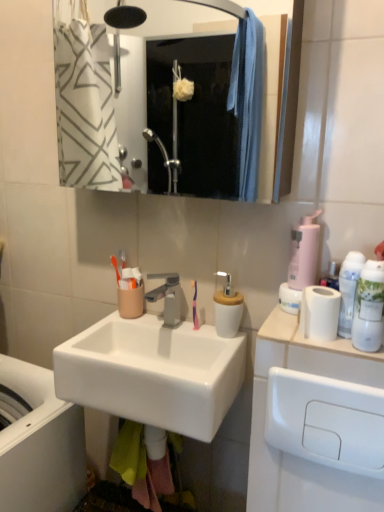
Question: Does white glossy mouthwash at right, which is the second mouthwash in back-to-front order, turn towards metallic silver mirror at upper center?

Choices:
 (A) no
 (B) yes

Answer: (A)

Question: Is white glossy mouthwash at right, which is the second mouthwash in back-to-front order, wider than metallic silver mirror at upper center?

Choices:
 (A) yes
 (B) no

Answer: (B)

Question: Is white glossy mouthwash at right, marked as the 1th mouthwash in a front-to-back arrangement, positioned far away from metallic silver mirror at upper center?

Choices:
 (A) yes
 (B) no

Answer: (A)

Question: Is white glossy mouthwash at right, marked as the 1th mouthwash in a front-to-back arrangement, positioned behind metallic silver mirror at upper center?

Choices:
 (A) yes
 (B) no

Answer: (B)

Question: Is metallic silver mirror at upper center completely or partially inside white glossy mouthwash at right, which is the second mouthwash in back-to-front order?

Choices:
 (A) no
 (B) yes

Answer: (A)

Question: From the image's perspective, relative to white plastic mouthwash at right, which is counted as the 1th mouthwash, starting from the back, is satin nickel faucet at center above or below?

Choices:
 (A) above
 (B) below

Answer: (B)

Question: Considering the positions of point (168, 311) and point (339, 308), is point (168, 311) closer or farther from the camera than point (339, 308)?

Choices:
 (A) closer
 (B) farther

Answer: (B)

Question: Is satin nickel faucet at center in front of or behind white plastic mouthwash at right, the second mouthwash when ordered from front to back, in the image?

Choices:
 (A) behind
 (B) front

Answer: (A)

Question: Considering the relative positions of satin nickel faucet at center and white plastic mouthwash at right, the second mouthwash when ordered from front to back, in the image provided, is satin nickel faucet at center to the left or to the right of white plastic mouthwash at right, the second mouthwash when ordered from front to back,?

Choices:
 (A) left
 (B) right

Answer: (A)

Question: Do you think white matte toilet paper at right is within purple plastic toothbrush at center, or outside of it?

Choices:
 (A) outside
 (B) inside

Answer: (A)

Question: In terms of width, does white matte toilet paper at right look wider or thinner when compared to purple plastic toothbrush at center?

Choices:
 (A) wide
 (B) thin

Answer: (A)

Question: From a real-world perspective, is white matte toilet paper at right positioned above or below purple plastic toothbrush at center?

Choices:
 (A) above
 (B) below

Answer: (A)

Question: Considering the positions of point (344, 347) and point (195, 292), is point (344, 347) closer or farther from the camera than point (195, 292)?

Choices:
 (A) farther
 (B) closer

Answer: (B)

Question: Would you say white glossy mouthwash at right, which is the second mouthwash in back-to-front order, is inside or outside white glossy sink at lower left?

Choices:
 (A) outside
 (B) inside

Answer: (A)

Question: Does point (357, 333) appear closer or farther from the camera than point (36, 392)?

Choices:
 (A) closer
 (B) farther

Answer: (A)